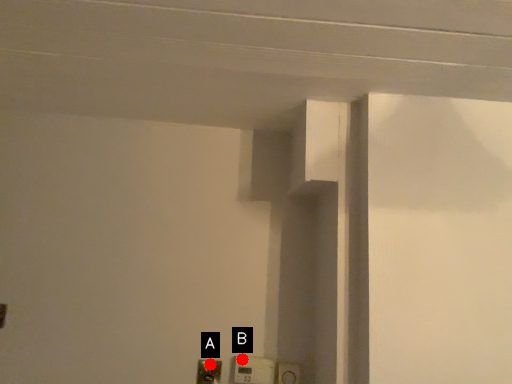
Question: Two points are circled on the image, labeled by A and B beside each circle. Which point appears closest to the camera in this image?

Choices:
 (A) A is closer
 (B) B is closer

Answer: (A)